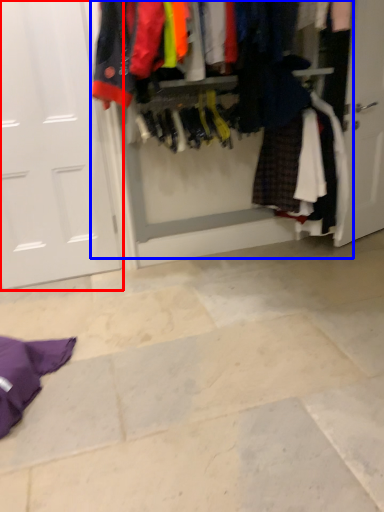
Question: Which point is closer to the camera, door (highlighted by a red box) or closet (highlighted by a blue box)?

Choices:
 (A) door
 (B) closet

Answer: (B)